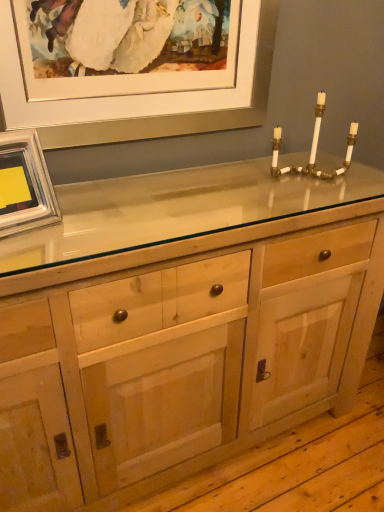
The width and height of the screenshot is (384, 512). Find the location of `vacant area to the right of silver metallic picture frame at upper left, arranged as the first picture frame when ordered from the bottom`. vacant area to the right of silver metallic picture frame at upper left, arranged as the first picture frame when ordered from the bottom is located at coordinates point(72,237).